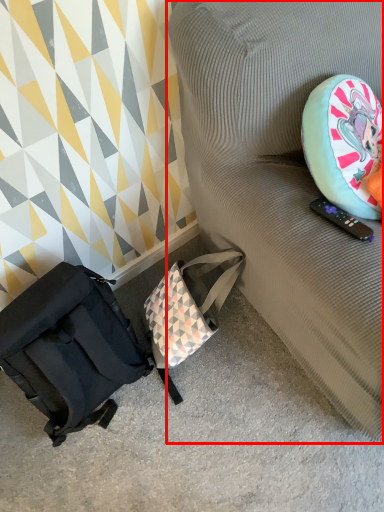
Question: In this image, where is furniture (annotated by the red box) located relative to luggage and bags?

Choices:
 (A) right
 (B) left

Answer: (A)